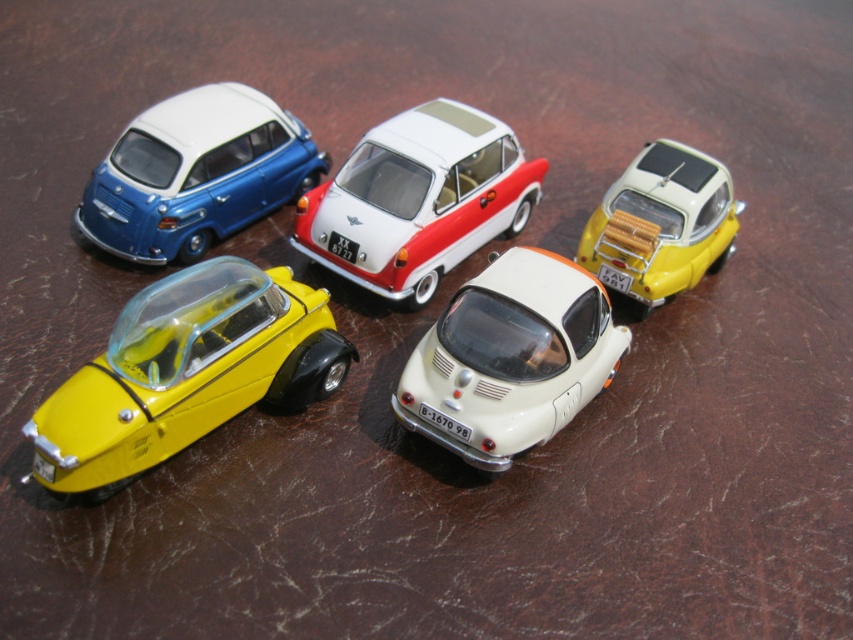
Question: Is white matte/satin car at center to the right of matte blue car at upper left from the viewer's perspective?

Choices:
 (A) no
 (B) yes

Answer: (B)

Question: Which object appears farthest from the camera in this image?

Choices:
 (A) yellow matte toy car at upper right
 (B) white matte/satin car at center

Answer: (A)

Question: Does white matte car at center have a lesser width compared to yellow matte toy car at upper right?

Choices:
 (A) yes
 (B) no

Answer: (B)

Question: Can you confirm if white matte car at center is positioned to the right of white matte/satin car at center?

Choices:
 (A) yes
 (B) no

Answer: (A)

Question: Based on their relative distances, which object is nearer to the white matte/satin car at center?

Choices:
 (A) matte blue car at upper left
 (B) white matte car at center

Answer: (B)

Question: Estimate the real-world distances between objects in this image. Which object is closer to the white matte/satin car at center?

Choices:
 (A) yellow matte toy car at lower left
 (B) yellow matte toy car at upper right
 (C) matte blue car at upper left

Answer: (C)